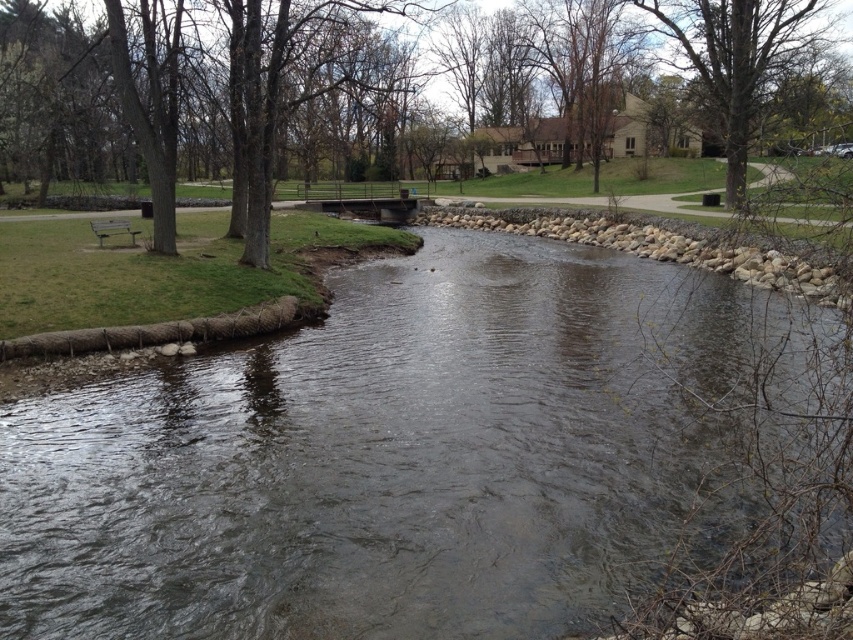
You are standing at the point labeled as point (735, 58) in the park scene. Based on the image description, what type of object or feature is located at that coordinate?

The point (735, 58) is located on a bare brown tree at upper center.

You are a park visitor who wants to walk from the metallic silver bench at left to the clear water at center. The park has a rule that visitors must stay at least 50 feet away from the water for safety. Can you safely walk to the water without violating the rule?

The distance between the metallic silver bench at left and the clear water at center is 49.90 feet, which is less than the required 50 feet. Therefore, walking to the water would violate the park rule.

You are a park visitor who wants to take a photo of the clear water at center. Based on the coordinates provided, where should you position yourself to capture the best shot?

The clear water at center is located at coordinates point (395, 458), so you should position yourself directly in front of it to capture the best shot.